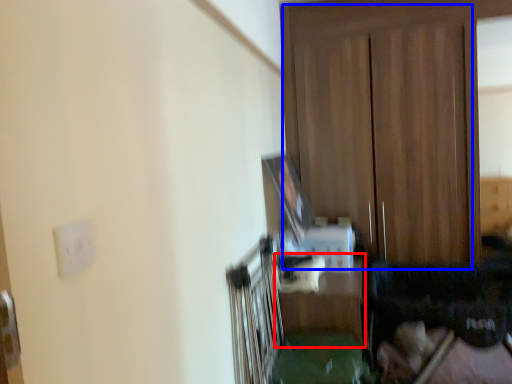
Question: Among these objects, which one is farthest to the camera, table (highlighted by a red box) or dresser (highlighted by a blue box)?

Choices:
 (A) table
 (B) dresser

Answer: (B)